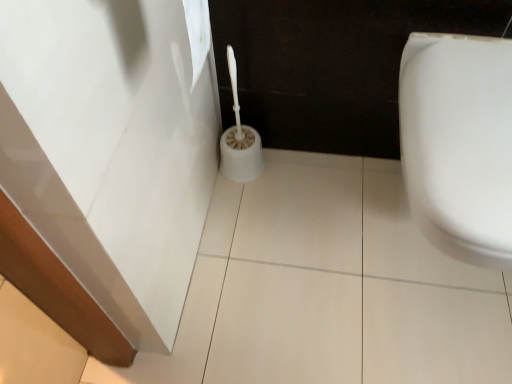
The height and width of the screenshot is (384, 512). Identify the location of white glossy toilet at right. (459, 143).

What do you see at coordinates (459, 143) in the screenshot? The width and height of the screenshot is (512, 384). I see `white glossy toilet at right` at bounding box center [459, 143].

In order to face white glossy toilet at right, should I rotate leftwards or rightwards?

You should look right and rotate roughly 27.061 degrees.

This screenshot has height=384, width=512. I want to click on white glossy toilet at right, so pos(459,143).